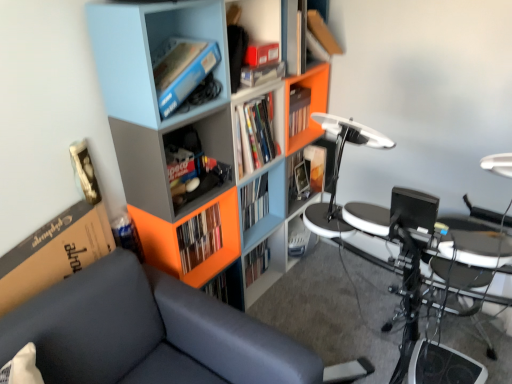
Question: From a real-world perspective, is matte cardboard box at upper center, which is the first shelf from top to bottom, positioned under matte blue bookshelf at upper left, which is the second shelf in top-to-bottom order, based on gravity?

Choices:
 (A) yes
 (B) no

Answer: (A)

Question: Can you confirm if matte cardboard box at upper center, which is the first shelf from top to bottom, is shorter than matte blue bookshelf at upper left, which is the second shelf from bottom to top?

Choices:
 (A) no
 (B) yes

Answer: (B)

Question: Considering the relative sizes of matte cardboard box at upper center, the 3th shelf from the bottom, and matte blue bookshelf at upper left, which is the second shelf in top-to-bottom order, in the image provided, is matte cardboard box at upper center, the 3th shelf from the bottom, bigger than matte blue bookshelf at upper left, which is the second shelf in top-to-bottom order,?

Choices:
 (A) yes
 (B) no

Answer: (B)

Question: From the image's perspective, is matte cardboard box at upper center, the 3th shelf from the bottom, located beneath matte blue bookshelf at upper left, which is the second shelf from bottom to top?

Choices:
 (A) yes
 (B) no

Answer: (B)

Question: Would you consider matte cardboard box at upper center, which is the first shelf from top to bottom, to be distant from matte blue bookshelf at upper left, which is the second shelf in top-to-bottom order?

Choices:
 (A) yes
 (B) no

Answer: (B)

Question: Is matte cardboard box at upper center, which is the first shelf from top to bottom, closer to camera compared to matte blue bookshelf at upper left, which is the second shelf in top-to-bottom order?

Choices:
 (A) no
 (B) yes

Answer: (A)

Question: From a real-world perspective, is matte plastic bookcase at upper left on top of matte plastic book at center, the second book from the left?

Choices:
 (A) yes
 (B) no

Answer: (A)

Question: From the image's perspective, is matte plastic bookcase at upper left beneath matte plastic book at center, acting as the second book starting from the front?

Choices:
 (A) no
 (B) yes

Answer: (B)

Question: Could you tell me if matte plastic bookcase at upper left is turned towards matte plastic book at center, arranged as the 1th book when viewed from the back?

Choices:
 (A) yes
 (B) no

Answer: (A)

Question: Is matte plastic bookcase at upper left positioned behind matte plastic book at center, which is the second book in bottom-to-top order?

Choices:
 (A) yes
 (B) no

Answer: (B)

Question: Is matte plastic book at center, which is the second book in bottom-to-top order, at the back of matte plastic bookcase at upper left?

Choices:
 (A) yes
 (B) no

Answer: (B)

Question: Considering the relative sizes of matte plastic bookcase at upper left and matte plastic book at center, the second book from the left, in the image provided, is matte plastic bookcase at upper left smaller than matte plastic book at center, the second book from the left,?

Choices:
 (A) yes
 (B) no

Answer: (B)

Question: Is metallic silver drum set at lower right smaller than dark gray fabric couch at left?

Choices:
 (A) yes
 (B) no

Answer: (A)